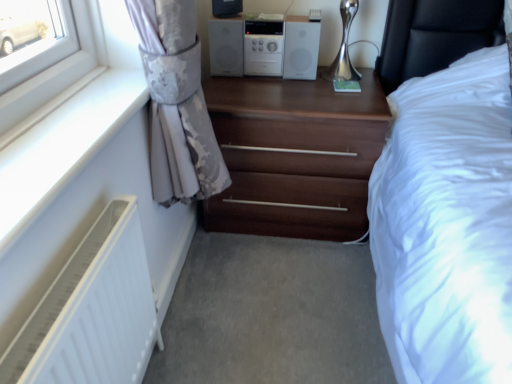
Find the location of a particular element. The image size is (512, 384). white plastic radiator at lower left is located at coordinates (63, 145).

This screenshot has width=512, height=384. Describe the element at coordinates (92, 311) in the screenshot. I see `white matte radiator at lower left` at that location.

Image resolution: width=512 pixels, height=384 pixels. I want to click on white plastic radiator at lower left, so click(63, 145).

Locate an element on the screen. This screenshot has height=384, width=512. radiator that appears below the white plastic stereo at upper center (from a real-world perspective) is located at coordinates (92, 311).

From the image's perspective, who appears lower, white plastic stereo at upper center or white matte radiator at lower left?

From the image's view, white matte radiator at lower left is below.

Which object is positioned more to the right, white plastic stereo at upper center or white matte radiator at lower left?

white plastic stereo at upper center is more to the right.

Looking at this image, is white plastic stereo at upper center not close to white matte radiator at lower left?

Yes, white plastic stereo at upper center is far from white matte radiator at lower left.

From the picture: Does dark wood chest of drawers at center have a greater width compared to silky gray curtain at left?

Yes, dark wood chest of drawers at center is wider than silky gray curtain at left.

Are dark wood chest of drawers at center and silky gray curtain at left beside each other?

There is a gap between dark wood chest of drawers at center and silky gray curtain at left.

Looking at the image, does dark wood chest of drawers at center seem bigger or smaller compared to silky gray curtain at left?

In the image, dark wood chest of drawers at center appears to be larger than silky gray curtain at left.

Can you tell me how much dark wood chest of drawers at center and silky gray curtain at left differ in facing direction?

90.4 degrees separate the facing orientations of dark wood chest of drawers at center and silky gray curtain at left.

Is white matte radiator at lower left at the right side of matte black speaker at upper center?

In fact, white matte radiator at lower left is to the left of matte black speaker at upper center.

Locate an element on the screen. The width and height of the screenshot is (512, 384). radiator below the matte black speaker at upper center (from the image's perspective) is located at coordinates (92, 311).

Considering the sizes of objects white matte radiator at lower left and matte black speaker at upper center in the image provided, who is shorter, white matte radiator at lower left or matte black speaker at upper center?

matte black speaker at upper center is shorter.

Which is farther, (x=298, y=66) or (x=234, y=10)?

Point (x=298, y=66)

Can you confirm if white plastic stereo at upper center is bigger than matte black speaker at upper center?

Indeed, white plastic stereo at upper center has a larger size compared to matte black speaker at upper center.

Is white plastic stereo at upper center positioned behind matte black speaker at upper center?

Yes, white plastic stereo at upper center is behind matte black speaker at upper center.

Can you confirm if dark wood chest of drawers at center is taller than matte black speaker at upper center?

Correct, dark wood chest of drawers at center is much taller as matte black speaker at upper center.

Can you tell me how much dark wood chest of drawers at center and matte black speaker at upper center differ in facing direction?

The angle between the facing direction of dark wood chest of drawers at center and the facing direction of matte black speaker at upper center is 34.3 degrees.

Where is `chest of drawers below the matte black speaker at upper center (from a real-world perspective)`? chest of drawers below the matte black speaker at upper center (from a real-world perspective) is located at coordinates (295, 155).

Would you consider dark wood chest of drawers at center to be distant from matte black speaker at upper center?

No, dark wood chest of drawers at center is in close proximity to matte black speaker at upper center.

Is white plastic radiator at lower left at the back of white matte radiator at lower left?

No, white plastic radiator at lower left is not at the back of white matte radiator at lower left.

You are a GUI agent. You are given a task and a screenshot of the screen. Output one action in this format:
    pyautogui.click(x=<x>, y=<y>)
    Task: Click on the window sill located on the left of white matte radiator at lower left
    
    Given the screenshot: What is the action you would take?
    pyautogui.click(x=63, y=145)

Which object is positioned more to the left, white matte radiator at lower left or white plastic radiator at lower left?

From the viewer's perspective, white plastic radiator at lower left appears more on the left side.

Is white matte radiator at lower left positioned far away from white plastic radiator at lower left?

No, there isn't a large distance between white matte radiator at lower left and white plastic radiator at lower left.

Considering the sizes of objects white plastic stereo at upper center and silky gray curtain at left in the image provided, who is wider, white plastic stereo at upper center or silky gray curtain at left?

white plastic stereo at upper center is wider.

Consider the image. From a real-world perspective, is white plastic stereo at upper center positioned above or below silky gray curtain at left?

white plastic stereo at upper center is situated higher than silky gray curtain at left in the real world.

The width and height of the screenshot is (512, 384). Find the location of `curtain on the left of white plastic stereo at upper center`. curtain on the left of white plastic stereo at upper center is located at coordinates (177, 104).

Locate an element on the screen. This screenshot has width=512, height=384. radiator located in front of the white plastic stereo at upper center is located at coordinates (92, 311).

You are a GUI agent. You are given a task and a screenshot of the screen. Output one action in this format:
    pyautogui.click(x=<x>, y=<y>)
    Task: Click on the curtain above the dark wood chest of drawers at center (from a real-world perspective)
    
    Given the screenshot: What is the action you would take?
    pyautogui.click(x=177, y=104)

Based on their spatial positions, is white matte radiator at lower left or dark wood chest of drawers at center closer to matte black speaker at upper center?

The object closer to matte black speaker at upper center is dark wood chest of drawers at center.

From the picture: Which object lies nearer to the anchor point white plastic stereo at upper center, white matte radiator at lower left or matte black speaker at upper center?

matte black speaker at upper center lies closer to white plastic stereo at upper center than the other object.

Based on their spatial positions, is white plastic stereo at upper center or white matte radiator at lower left further from matte black speaker at upper center?

white matte radiator at lower left lies further to matte black speaker at upper center than the other object.

Considering their positions, is silky gray curtain at left positioned further to white plastic radiator at lower left than white matte radiator at lower left?

white matte radiator at lower left.

Estimate the real-world distances between objects in this image. Which object is further from silky gray curtain at left, matte black speaker at upper center or white matte radiator at lower left?

matte black speaker at upper center lies further to silky gray curtain at left than the other object.

Estimate the real-world distances between objects in this image. Which object is closer to white plastic stereo at upper center, white matte radiator at lower left or dark wood chest of drawers at center?

dark wood chest of drawers at center lies closer to white plastic stereo at upper center than the other object.

Based on their spatial positions, is white plastic radiator at lower left or white plastic stereo at upper center further from silky gray curtain at left?

white plastic stereo at upper center is positioned further to the anchor silky gray curtain at left.

Considering their positions, is silky gray curtain at left positioned closer to white matte radiator at lower left than white plastic stereo at upper center?

silky gray curtain at left is closer to white matte radiator at lower left.

At what (x,y) coordinates should I click in order to perform the action: click on curtain between white plastic radiator at lower left and matte black speaker at upper center in the front-back direction. Please return your answer as a coordinate pair (x, y). Looking at the image, I should click on (177, 104).

Locate an element on the screen. The height and width of the screenshot is (384, 512). the chest of drawers positioned between silky gray curtain at left and white plastic stereo at upper center from near to far is located at coordinates pos(295,155).

Locate an element on the screen. This screenshot has height=384, width=512. stereo between matte black speaker at upper center and dark wood chest of drawers at center from top to bottom is located at coordinates click(x=265, y=47).

The height and width of the screenshot is (384, 512). Identify the location of the chest of drawers located between silky gray curtain at left and matte black speaker at upper center in the depth direction. (295, 155).